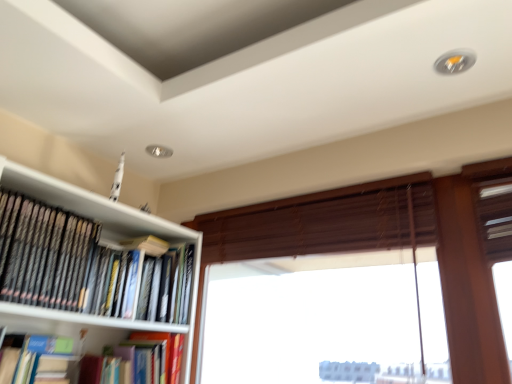
What is the approximate width of brown wood window at upper center?

It is 8.78 centimeters.

Describe the element at coordinates (158, 354) in the screenshot. I see `hardcover book at center, which ranks as the first book in bottom-to-top order` at that location.

Where is `blue matte book at lower left, marked as the 2th book in a bottom-to-top arrangement`? This screenshot has height=384, width=512. blue matte book at lower left, marked as the 2th book in a bottom-to-top arrangement is located at coordinates (38, 361).

What is the approximate height of blue matte book at lower left, the second book from the top?

The height of blue matte book at lower left, the second book from the top, is 10.72 inches.

Locate an element on the screen. The image size is (512, 384). brown wood window at upper center is located at coordinates (319, 226).

Is brown wooden blind at center situated inside hardcover book at center, acting as the third book starting from the top, or outside?

brown wooden blind at center is spatially situated outside hardcover book at center, acting as the third book starting from the top.

Is brown wooden blind at center shorter than hardcover book at center, which ranks as the first book in bottom-to-top order?

In fact, brown wooden blind at center may be taller than hardcover book at center, which ranks as the first book in bottom-to-top order.

Who is smaller, brown wooden blind at center or hardcover book at center, acting as the third book starting from the top?

With smaller size is hardcover book at center, acting as the third book starting from the top.

Is brown wooden blind at center to the right of hardcover book at center, which ranks as the first book in bottom-to-top order, from the viewer's perspective?

A: Yes.

Is the surface of blue matte book at lower left, the second book from the top, in direct contact with brown wooden blind at center?

No, blue matte book at lower left, the second book from the top, is not touching brown wooden blind at center.

Is blue matte book at lower left, marked as the 2th book in a bottom-to-top arrangement, oriented towards brown wooden blind at center?

No.

Is blue matte book at lower left, marked as the 2th book in a bottom-to-top arrangement, to the left of brown wooden blind at center from the viewer's perspective?

Yes, blue matte book at lower left, marked as the 2th book in a bottom-to-top arrangement, is to the left of brown wooden blind at center.

Which point is more forward, (337,239) or (102,308)?

The point (102,308) is closer.

From a real-world perspective, is brown wooden blind at center located higher than black matte bookshelf at upper left, marked as the third book in a bottom-to-top arrangement?

Yes, from a real-world perspective, brown wooden blind at center is on top of black matte bookshelf at upper left, marked as the third book in a bottom-to-top arrangement.

Considering the relative sizes of brown wooden blind at center and black matte bookshelf at upper left, which is the 1th book in top-to-bottom order, in the image provided, is brown wooden blind at center smaller than black matte bookshelf at upper left, which is the 1th book in top-to-bottom order,?

No.

From the image's perspective, which is below, brown wooden blind at center or black matte bookshelf at upper left, which is the 1th book in top-to-bottom order?

black matte bookshelf at upper left, which is the 1th book in top-to-bottom order.

Would you say brown wood window at upper center is to the left or to the right of brown wooden blind at center in the picture?

From the image, it's evident that brown wood window at upper center is to the right of brown wooden blind at center.

Are brown wood window at upper center and brown wooden blind at center far apart?

No.

In the scene shown: Which of these two, brown wood window at upper center or brown wooden blind at center, stands taller?

→ brown wood window at upper center is taller.

Does blue matte book at lower left, marked as the 2th book in a bottom-to-top arrangement, have a greater width compared to hardcover book at center, which ranks as the first book in bottom-to-top order?

In fact, blue matte book at lower left, marked as the 2th book in a bottom-to-top arrangement, might be narrower than hardcover book at center, which ranks as the first book in bottom-to-top order.

Which is in front, point (50, 377) or point (132, 380)?

The point (50, 377) is in front.

From a real-world perspective, is blue matte book at lower left, the second book from the top, positioned above or below hardcover book at center, acting as the third book starting from the top?

From a real-world perspective, blue matte book at lower left, the second book from the top, is physically below hardcover book at center, acting as the third book starting from the top.

This screenshot has height=384, width=512. Find the location of `the 2nd book counting from the right of the blue matte book at lower left, marked as the 2th book in a bottom-to-top arrangement`. the 2nd book counting from the right of the blue matte book at lower left, marked as the 2th book in a bottom-to-top arrangement is located at coordinates (158, 354).

Is hardcover book at center, which ranks as the first book in bottom-to-top order, located outside brown wood window at upper center?

Yes.

Which of these two, hardcover book at center, which ranks as the first book in bottom-to-top order, or brown wood window at upper center, is wider?

With larger width is hardcover book at center, which ranks as the first book in bottom-to-top order.

Is hardcover book at center, which ranks as the first book in bottom-to-top order, positioned behind brown wood window at upper center?

Yes, hardcover book at center, which ranks as the first book in bottom-to-top order, is behind brown wood window at upper center.

What's the angular difference between hardcover book at center, acting as the third book starting from the top, and brown wood window at upper center's facing directions?

They differ by 91.5 degrees in their facing directions.

Is brown wood window at upper center a part of blue matte book at lower left, the second book from the top?

No, brown wood window at upper center is located outside of blue matte book at lower left, the second book from the top.

Does blue matte book at lower left, marked as the 2th book in a bottom-to-top arrangement, turn towards brown wood window at upper center?

No, blue matte book at lower left, marked as the 2th book in a bottom-to-top arrangement, is not oriented towards brown wood window at upper center.

In the scene shown: Which object is positioned more to the left, blue matte book at lower left, the second book from the top, or brown wood window at upper center?

Positioned to the left is blue matte book at lower left, the second book from the top.

The image size is (512, 384). I want to click on the 3rd book counting from the left of the brown wood window at upper center, so click(38, 361).

Where is `the 1st book in front of the brown wooden blind at center, starting your count from the anchor`? This screenshot has width=512, height=384. the 1st book in front of the brown wooden blind at center, starting your count from the anchor is located at coordinates (158, 354).

Where is `blind lying behind the blue matte book at lower left, marked as the 2th book in a bottom-to-top arrangement`? This screenshot has height=384, width=512. blind lying behind the blue matte book at lower left, marked as the 2th book in a bottom-to-top arrangement is located at coordinates (323, 222).

Estimate the real-world distances between objects in this image. Which object is closer to blue matte book at lower left, the second book from the top, hardcover book at center, acting as the third book starting from the top, or black matte bookshelf at upper left, marked as the third book in a bottom-to-top arrangement?

hardcover book at center, acting as the third book starting from the top, is positioned closer to the anchor blue matte book at lower left, the second book from the top.

Estimate the real-world distances between objects in this image. Which object is closer to black matte bookshelf at upper left, marked as the third book in a bottom-to-top arrangement, brown wooden blind at center or blue matte book at lower left, marked as the 2th book in a bottom-to-top arrangement?

blue matte book at lower left, marked as the 2th book in a bottom-to-top arrangement, lies closer to black matte bookshelf at upper left, marked as the third book in a bottom-to-top arrangement, than the other object.

Considering their positions, is brown wooden blind at center positioned further to brown wood window at upper center than hardcover book at center, acting as the third book starting from the top?

Based on the image, hardcover book at center, acting as the third book starting from the top, appears to be further to brown wood window at upper center.

Which object lies nearer to the anchor point black matte bookshelf at upper left, marked as the third book in a bottom-to-top arrangement, hardcover book at center, acting as the third book starting from the top, or brown wood window at upper center?

Based on the image, hardcover book at center, acting as the third book starting from the top, appears to be nearer to black matte bookshelf at upper left, marked as the third book in a bottom-to-top arrangement.

Based on their spatial positions, is hardcover book at center, which ranks as the first book in bottom-to-top order, or brown wood window at upper center further from blue matte book at lower left, marked as the 2th book in a bottom-to-top arrangement?

The object further to blue matte book at lower left, marked as the 2th book in a bottom-to-top arrangement, is brown wood window at upper center.

From the image, which object appears to be nearer to brown wood window at upper center, hardcover book at center, which ranks as the first book in bottom-to-top order, or black matte bookshelf at upper left, which is the 1th book in top-to-bottom order?

black matte bookshelf at upper left, which is the 1th book in top-to-bottom order, is positioned closer to the anchor brown wood window at upper center.

Which object lies further to the anchor point black matte bookshelf at upper left, which is the 1th book in top-to-bottom order, hardcover book at center, acting as the third book starting from the top, or blue matte book at lower left, marked as the 2th book in a bottom-to-top arrangement?

hardcover book at center, acting as the third book starting from the top, is further to black matte bookshelf at upper left, which is the 1th book in top-to-bottom order.

In the scene shown: Considering their positions, is brown wood window at upper center positioned further to hardcover book at center, which ranks as the first book in bottom-to-top order, than blue matte book at lower left, the second book from the top?

brown wood window at upper center.

The width and height of the screenshot is (512, 384). In order to click on book situated between black matte bookshelf at upper left, marked as the third book in a bottom-to-top arrangement, and brown wooden blind at center from left to right in this screenshot , I will do `click(158, 354)`.

Locate an element on the screen. blind between hardcover book at center, which ranks as the first book in bottom-to-top order, and brown wood window at upper center is located at coordinates (323, 222).

Identify the location of book between black matte bookshelf at upper left, marked as the third book in a bottom-to-top arrangement, and hardcover book at center, acting as the third book starting from the top, in the up-down direction. (38, 361).

In order to click on book between black matte bookshelf at upper left, marked as the third book in a bottom-to-top arrangement, and brown wood window at upper center, in the horizontal direction in this screenshot , I will do `click(158, 354)`.